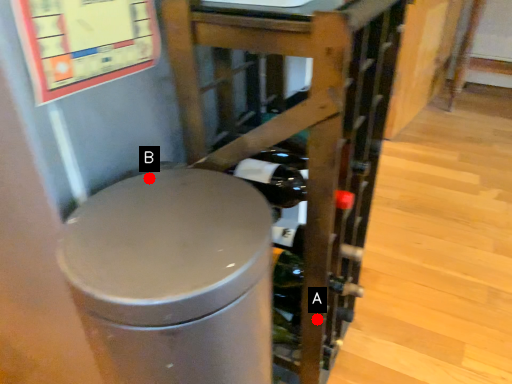
Question: Two points are circled on the image, labeled by A and B beside each circle. Which of the following is the closest to the observer?

Choices:
 (A) A is closer
 (B) B is closer

Answer: (B)